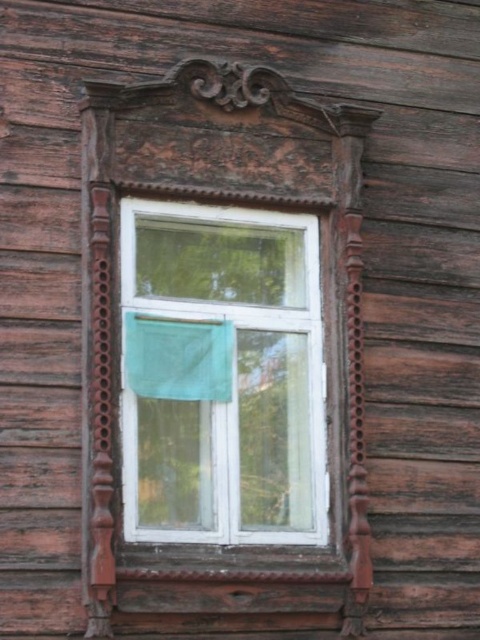
Question: Which of the following is the farthest from the observer?

Choices:
 (A) green fabric at center
 (B) white wood window at center

Answer: (A)

Question: Does white wood window at center have a greater width compared to green fabric at center?

Choices:
 (A) yes
 (B) no

Answer: (A)

Question: Among these points, which one is nearest to the camera?

Choices:
 (A) (130, 369)
 (B) (202, 237)

Answer: (A)

Question: Does white wood window at center have a smaller size compared to green fabric at center?

Choices:
 (A) yes
 (B) no

Answer: (B)

Question: Is white wood window at center bigger than green fabric at center?

Choices:
 (A) yes
 (B) no

Answer: (A)

Question: Which object appears farthest from the camera in this image?

Choices:
 (A) green fabric at center
 (B) white wood window at center

Answer: (A)